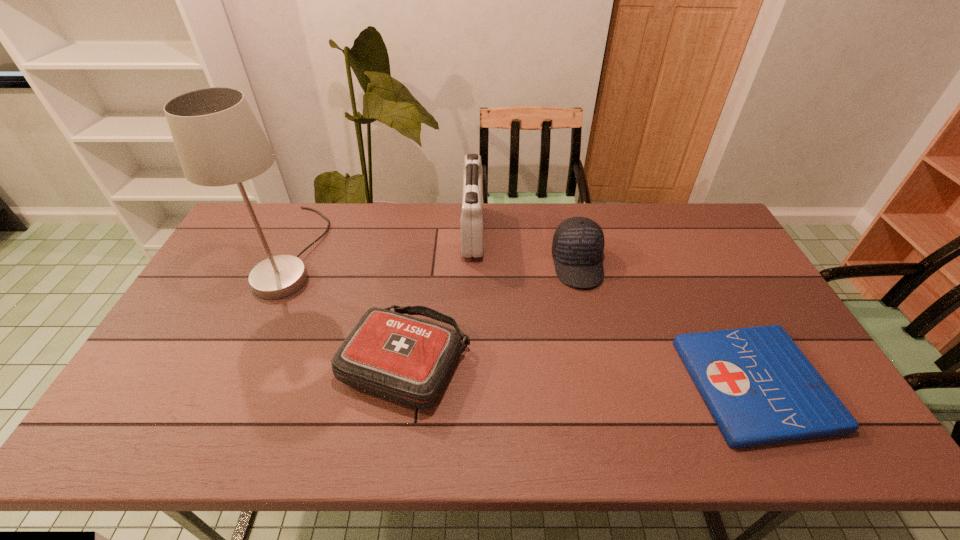
The width and height of the screenshot is (960, 540). I want to click on free location that satisfies the following two spatial constraints: 1. on the back side of the shortest first-aid kit; 2. on the front side of the tallest first-aid kit, so click(x=677, y=233).

Where is `free spot that satisfies the following two spatial constraints: 1. on the front side of the leftmost object; 2. on the right side of the shortest object`? Image resolution: width=960 pixels, height=540 pixels. free spot that satisfies the following two spatial constraints: 1. on the front side of the leftmost object; 2. on the right side of the shortest object is located at coordinates (232, 384).